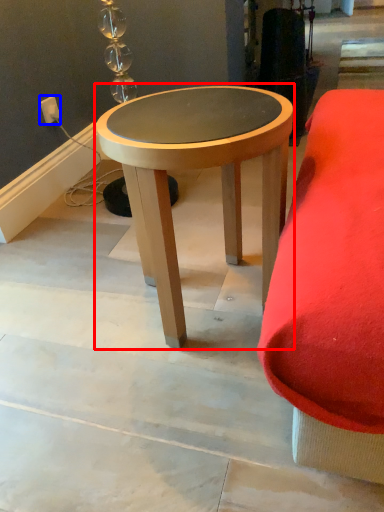
Question: Among these objects, which one is nearest to the camera, coffee table (highlighted by a red box) or electric outlet (highlighted by a blue box)?

Choices:
 (A) coffee table
 (B) electric outlet

Answer: (A)